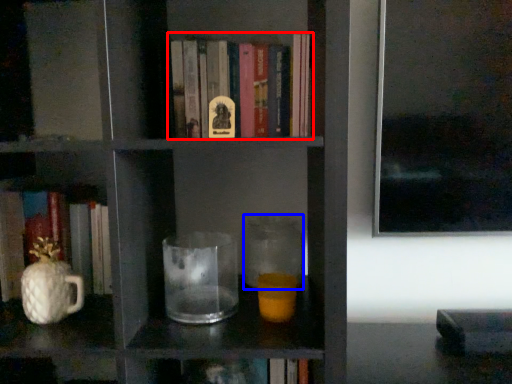
Question: Which object is closer to the camera taking this photo, book (highlighted by a red box) or glass jar (highlighted by a blue box)?

Choices:
 (A) book
 (B) glass jar

Answer: (A)